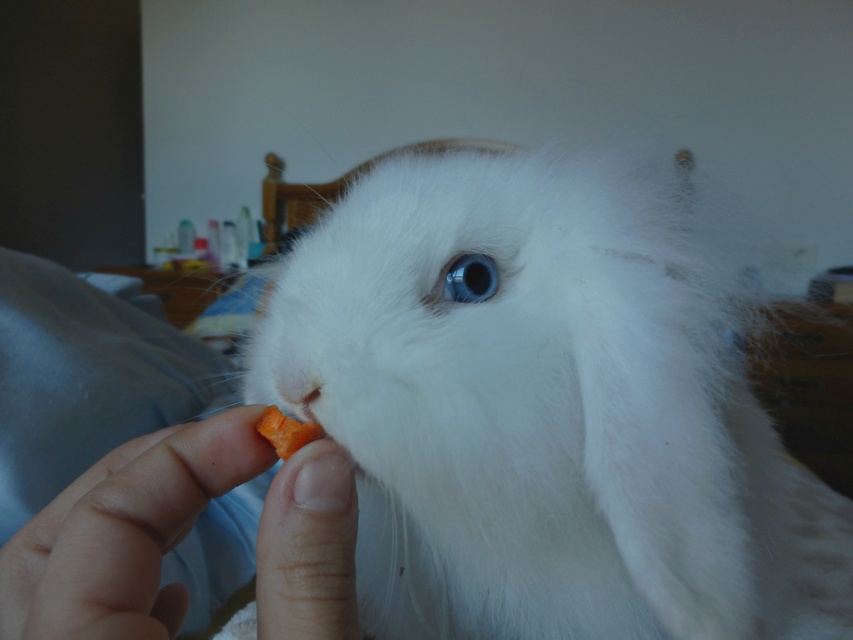
Identify the location of white fluffy rabbit at center. (544, 413).

Is white fluffy rabbit at center smaller than smooth skin at lower left?

No, white fluffy rabbit at center is not smaller than smooth skin at lower left.

Is point (503, 188) farther from viewer compared to point (126, 547)?

Yes, it is behind point (126, 547).

At what (x,y) coordinates should I click in order to perform the action: click on white fluffy rabbit at center. Please return your answer as a coordinate pair (x, y). Looking at the image, I should click on (544, 413).